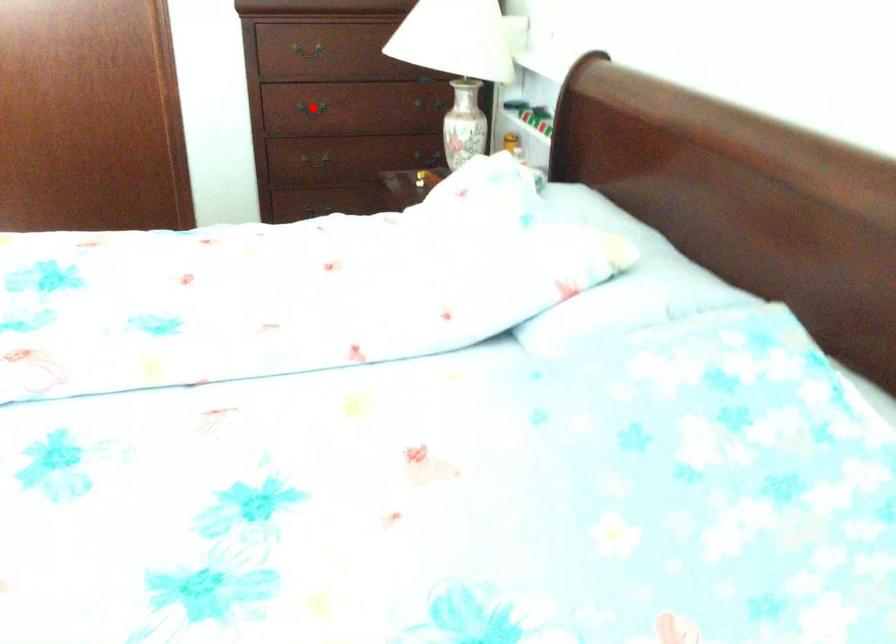
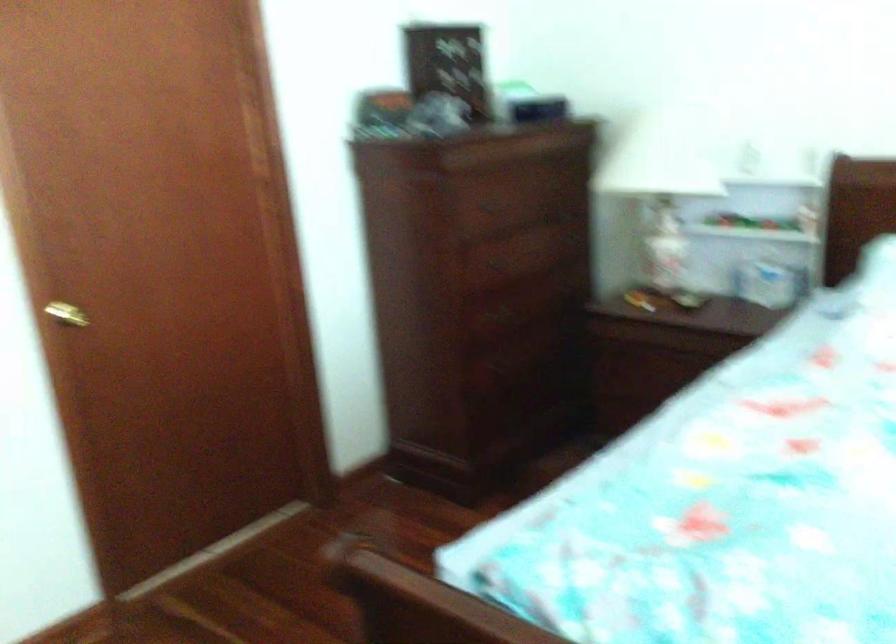
Question: I am providing you with two images of the same scene from different viewpoints. A red point is marked on the first image. Can you still see the location of the red point in image 2?

Choices:
 (A) Yes
 (B) No

Answer: (B)